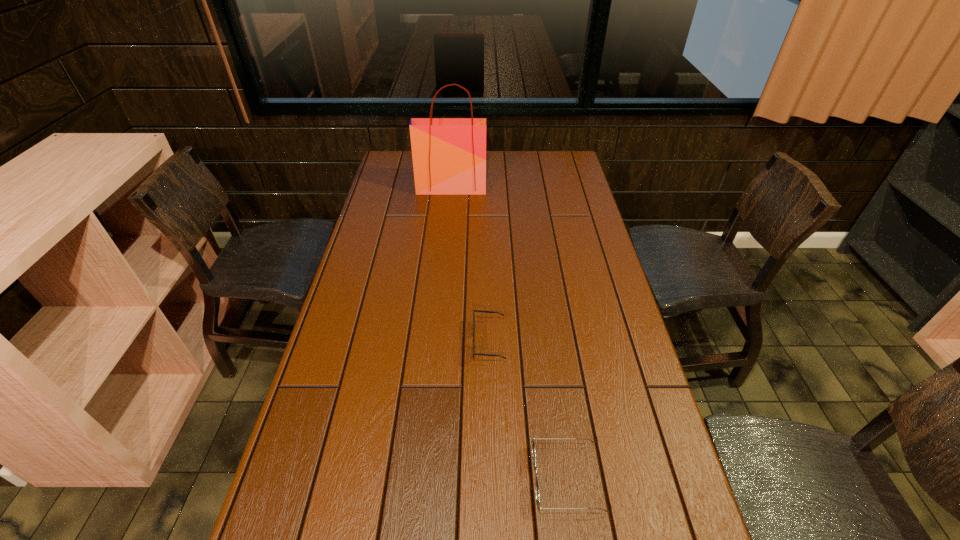
The image size is (960, 540). I want to click on free spot located on the front-facing side of the second farthest sunglasses, so click(412, 478).

Where is `free space located 0.190m on the front-facing side of the second farthest sunglasses`? free space located 0.190m on the front-facing side of the second farthest sunglasses is located at coordinates (444, 478).

I want to click on vacant region located on the front-facing side of the second farthest sunglasses, so click(370, 478).

Locate an element on the screen. The width and height of the screenshot is (960, 540). object present at the left edge is located at coordinates (449, 154).

What are the coordinates of `object positioned at the right edge` in the screenshot? It's located at tap(533, 443).

This screenshot has height=540, width=960. Find the location of `blank space at the far edge of the desktop`. blank space at the far edge of the desktop is located at coordinates (506, 151).

Where is `vacant space at the left edge of the desktop`? This screenshot has width=960, height=540. vacant space at the left edge of the desktop is located at coordinates (377, 198).

The width and height of the screenshot is (960, 540). In the image, there is a desktop. In order to click on blank space at the right edge in this screenshot , I will do `click(615, 410)`.

Locate an element on the screen. This screenshot has height=540, width=960. vacant space at the far left corner of the desktop is located at coordinates (397, 174).

Find the location of a particular element. vacant area that lies between the second farthest object and the rightmost object is located at coordinates (528, 410).